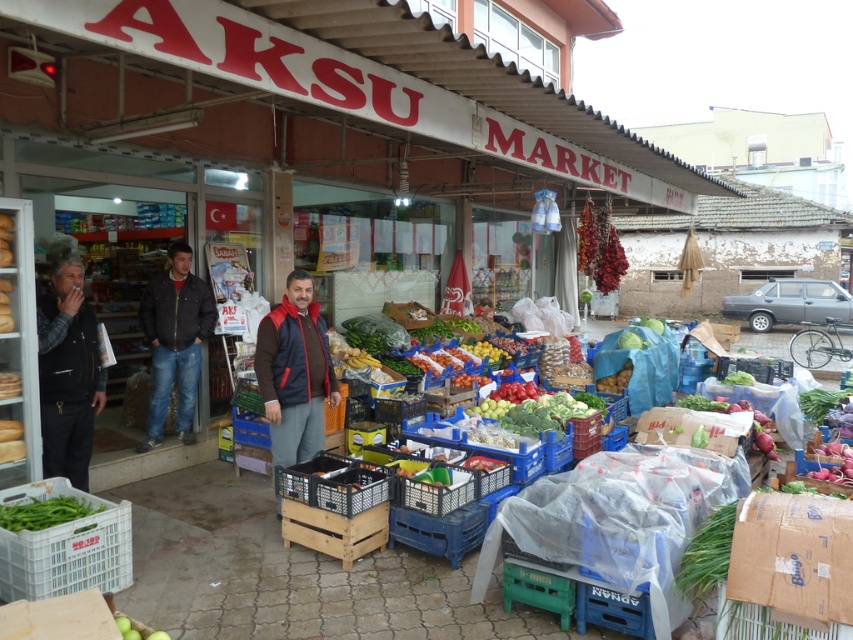
Describe the element at coordinates (67, 371) in the screenshot. I see `dark gray jacket at left` at that location.

What are the coordinates of `dark gray jacket at left` in the screenshot? It's located at (67, 371).

This screenshot has width=853, height=640. What do you see at coordinates (67, 371) in the screenshot? I see `dark gray jacket at left` at bounding box center [67, 371].

I want to click on dark gray jacket at left, so click(x=67, y=371).

Can you confirm if dark gray jacket at left is positioned above green matte beans at lower left?

Correct, dark gray jacket at left is located above green matte beans at lower left.

Between dark gray jacket at left and green matte beans at lower left, which one appears on the right side from the viewer's perspective?

green matte beans at lower left is more to the right.

Between point (45, 324) and point (61, 518), which one is positioned in front?

Positioned in front is point (61, 518).

You are a GUI agent. You are given a task and a screenshot of the screen. Output one action in this format:
    pyautogui.click(x=<x>, y=<y>)
    Task: Click on the dark gray jacket at left
    The width and height of the screenshot is (853, 640).
    Given the screenshot: What is the action you would take?
    click(67, 371)

Is dark gray jacket at left wider than brown/red jacket at center?

Correct, the width of dark gray jacket at left exceeds that of brown/red jacket at center.

Is dark gray jacket at left to the right of brown/red jacket at center from the viewer's perspective?

Incorrect, dark gray jacket at left is not on the right side of brown/red jacket at center.

Where is `dark gray jacket at left`? The height and width of the screenshot is (640, 853). dark gray jacket at left is located at coordinates (67, 371).